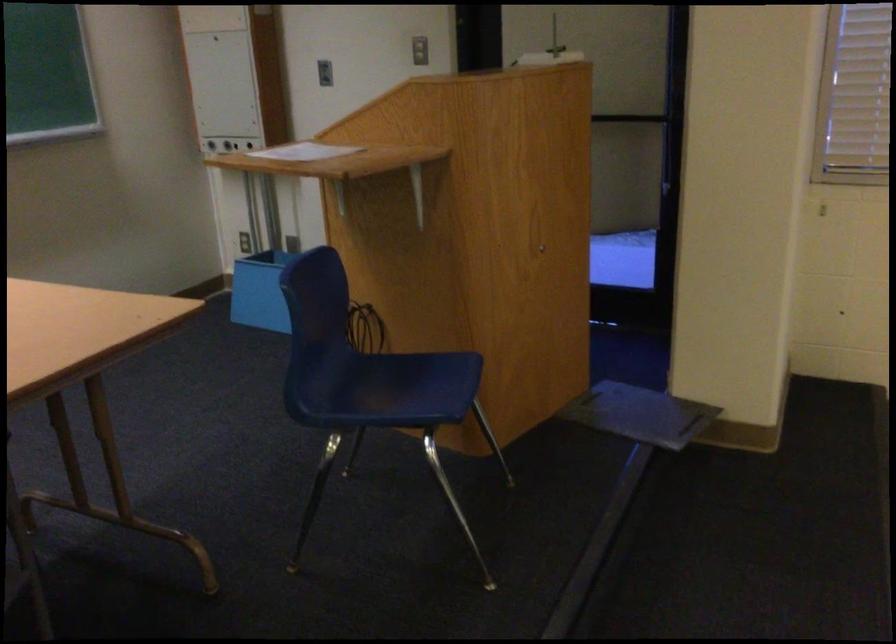
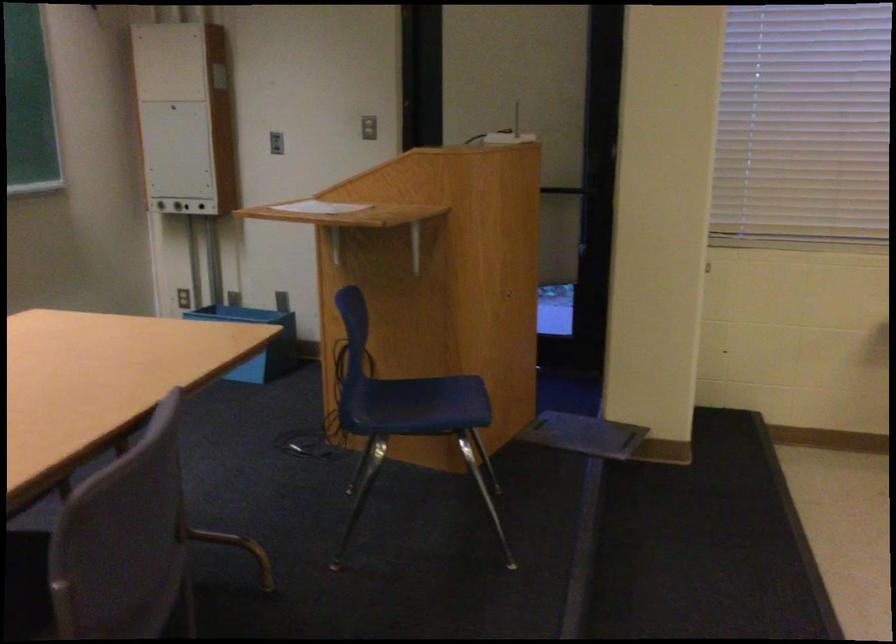
Consider the image. What movement of the cameraman would produce the second image?

The cameraman walked toward left, backward.